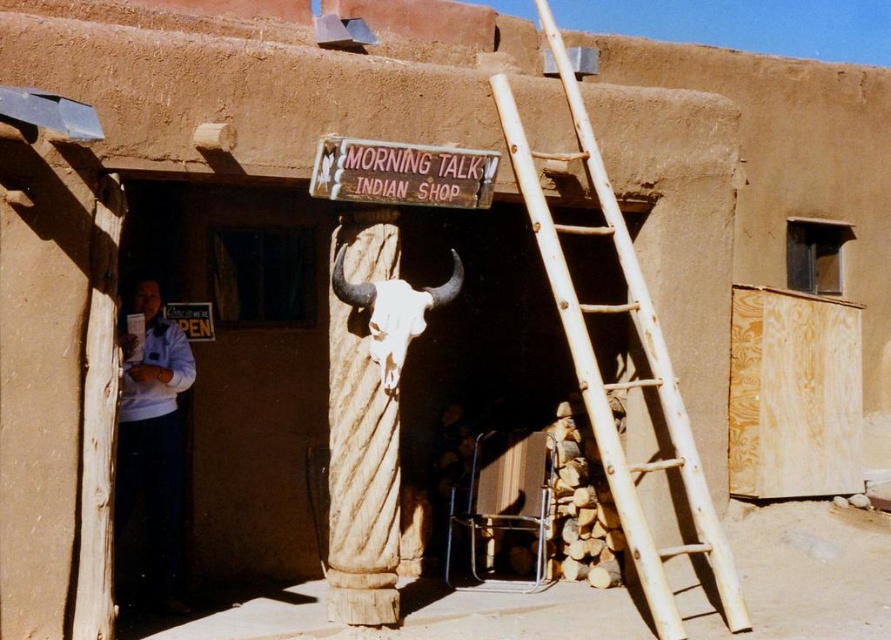
Question: Which point is closer to the camera?

Choices:
 (A) white bone skull at center
 (B) white cotton shirt at left

Answer: (A)

Question: Is natural wood ladder at right positioned in front of white cotton shirt at left?

Choices:
 (A) no
 (B) yes

Answer: (B)

Question: Which of the following is the closest to the observer?

Choices:
 (A) natural wood ladder at right
 (B) white cotton shirt at left
 (C) wooden sign at center
 (D) white bone skull at center

Answer: (A)

Question: Where is white cotton shirt at left located in relation to wooden sign at center in the image?

Choices:
 (A) above
 (B) below

Answer: (B)

Question: Can you confirm if white cotton shirt at left is positioned below white bone skull at center?

Choices:
 (A) yes
 (B) no

Answer: (A)

Question: Which of the following is the closest to the observer?

Choices:
 (A) wooden sign at center
 (B) white bone skull at center
 (C) white cotton shirt at left

Answer: (A)